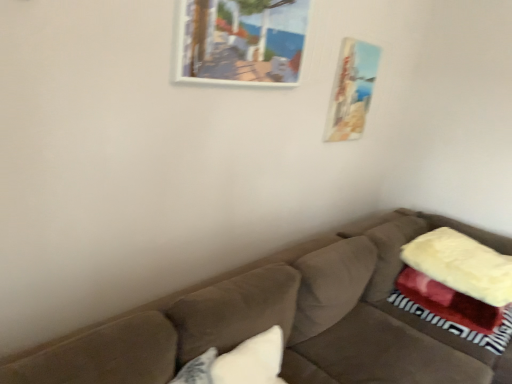
Question: Is matte wooden picture frame at upper right, the second picture frame in the left-to-right sequence, not close to suede brown couch at center?

Choices:
 (A) no
 (B) yes

Answer: (A)

Question: Does matte wooden picture frame at upper right, which is counted as the 2th picture frame, starting from the front, turn towards suede brown couch at center?

Choices:
 (A) no
 (B) yes

Answer: (A)

Question: Is matte wooden picture frame at upper right, the first picture frame from the right, in front of suede brown couch at center?

Choices:
 (A) no
 (B) yes

Answer: (A)

Question: Does matte wooden picture frame at upper right, the first picture frame from the right, appear on the left side of suede brown couch at center?

Choices:
 (A) no
 (B) yes

Answer: (A)

Question: Is matte wooden picture frame at upper right, the first picture frame from the right, wider than suede brown couch at center?

Choices:
 (A) no
 (B) yes

Answer: (A)

Question: Is wooden picture frame at upper center, acting as the 2th picture frame starting from the right, wider or thinner than white soft pillow at lower center?

Choices:
 (A) thin
 (B) wide

Answer: (A)

Question: Considering the positions of wooden picture frame at upper center, the 2th picture frame in the back-to-front sequence, and white soft pillow at lower center in the image, is wooden picture frame at upper center, the 2th picture frame in the back-to-front sequence, taller or shorter than white soft pillow at lower center?

Choices:
 (A) tall
 (B) short

Answer: (A)

Question: In the image, is wooden picture frame at upper center, which appears as the first picture frame when viewed from the left, positioned in front of or behind white soft pillow at lower center?

Choices:
 (A) front
 (B) behind

Answer: (B)

Question: Choose the correct answer: Is wooden picture frame at upper center, placed as the first picture frame when sorted from front to back, inside white soft pillow at lower center or outside it?

Choices:
 (A) outside
 (B) inside

Answer: (A)

Question: Looking at their shapes, would you say wooden picture frame at upper center, which appears as the first picture frame when viewed from the left, is wider or thinner than suede brown couch at center?

Choices:
 (A) wide
 (B) thin

Answer: (B)

Question: In the image, is wooden picture frame at upper center, placed as the first picture frame when sorted from front to back, positioned in front of or behind suede brown couch at center?

Choices:
 (A) behind
 (B) front

Answer: (A)

Question: Is wooden picture frame at upper center, placed as the first picture frame when sorted from front to back, taller or shorter than suede brown couch at center?

Choices:
 (A) short
 (B) tall

Answer: (A)

Question: From a real-world perspective, is wooden picture frame at upper center, which appears as the first picture frame when viewed from the left, positioned above or below suede brown couch at center?

Choices:
 (A) above
 (B) below

Answer: (A)

Question: From the image's perspective, is matte wooden picture frame at upper right, the second picture frame in the left-to-right sequence, located above or below wooden picture frame at upper center, acting as the 2th picture frame starting from the right?

Choices:
 (A) below
 (B) above

Answer: (A)

Question: In the image, is matte wooden picture frame at upper right, the second picture frame in the left-to-right sequence, on the left side or the right side of wooden picture frame at upper center, acting as the 2th picture frame starting from the right?

Choices:
 (A) left
 (B) right

Answer: (B)